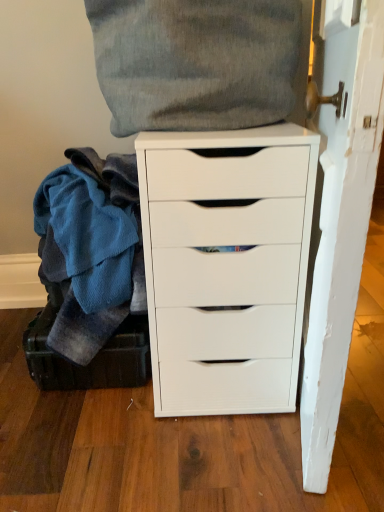
Image resolution: width=384 pixels, height=512 pixels. I want to click on free space in front of white matte chest of drawers at center, so click(x=206, y=462).